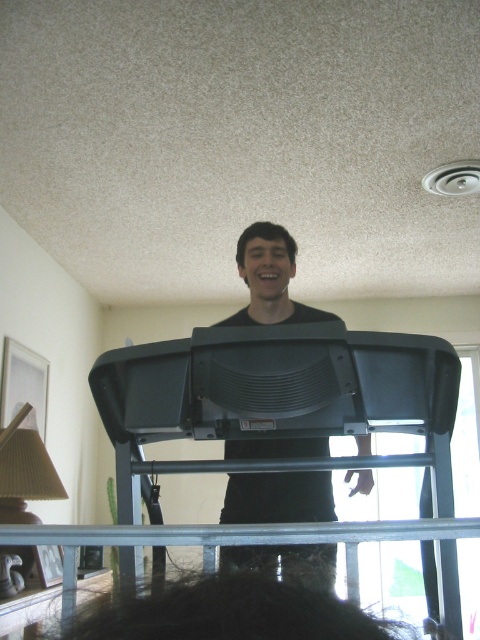
From the picture: Can you confirm if black plastic ladder at center is taller than black matte treadmill at center?

Yes.

This screenshot has height=640, width=480. Describe the element at coordinates (276, 397) in the screenshot. I see `black plastic ladder at center` at that location.

Identify the location of black plastic ladder at center. (276, 397).

Can you confirm if black plastic ladder at center is bigger than metal/textured rail at lower center?

Yes, black plastic ladder at center is bigger than metal/textured rail at lower center.

Between black plastic ladder at center and metal/textured rail at lower center, which one is positioned higher?

black plastic ladder at center

Where is `black plastic ladder at center`? This screenshot has width=480, height=640. black plastic ladder at center is located at coordinates (276, 397).

Can you confirm if black matte treadmill at center is shorter than metal/textured rail at lower center?

No.

Can you confirm if black matte treadmill at center is positioned to the right of metal/textured rail at lower center?

Correct, you'll find black matte treadmill at center to the right of metal/textured rail at lower center.

Does point (326, 449) lie behind point (35, 529)?

Yes.

Image resolution: width=480 pixels, height=640 pixels. In order to click on black matte treadmill at center in this screenshot , I will do coord(269,278).